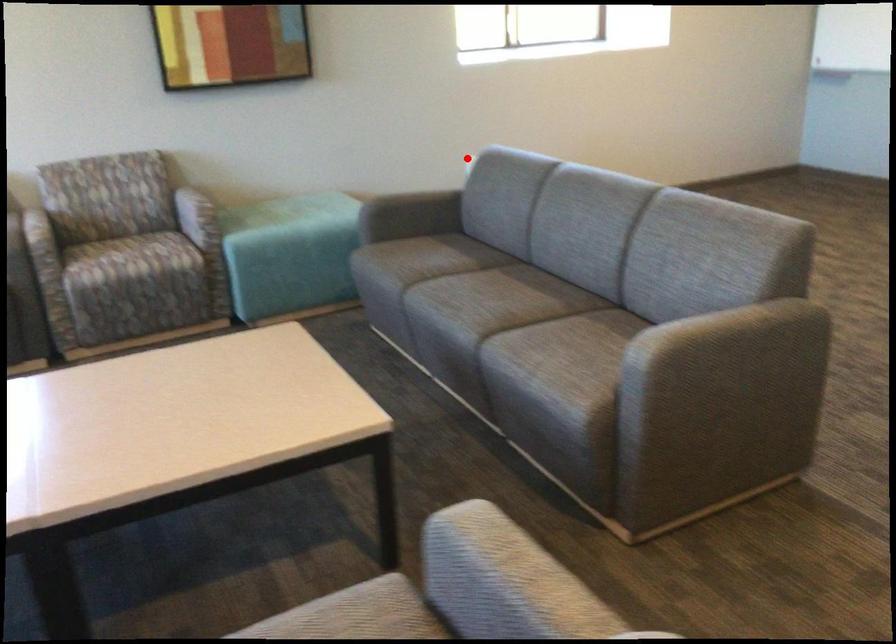
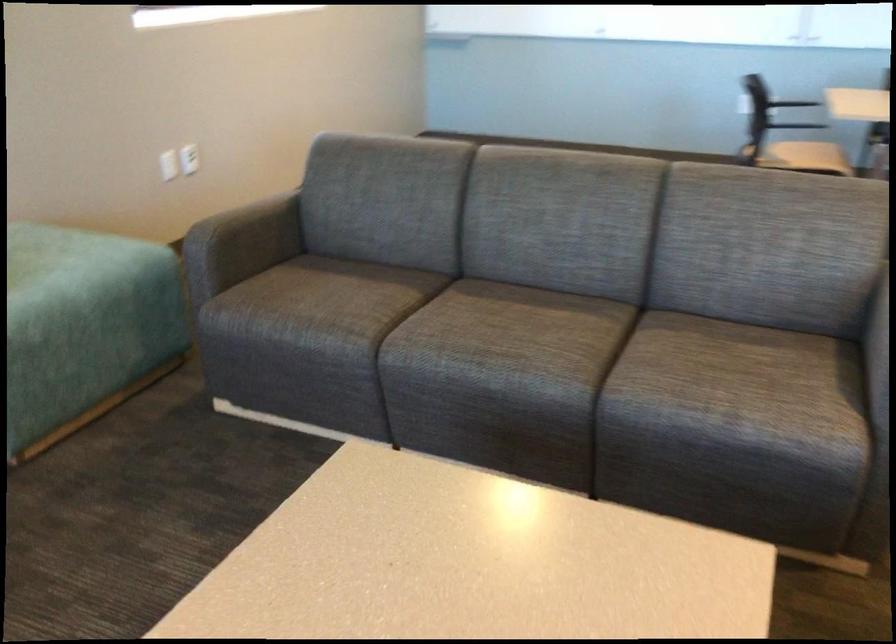
Question: I am providing you with two images of the same scene from different viewpoints. Image1 has a red point marked. In image2, the corresponding 3D location appears at what relative position? Reply with the corresponding letter.

Choices:
 (A) Closer
 (B) Farther

Answer: (A)